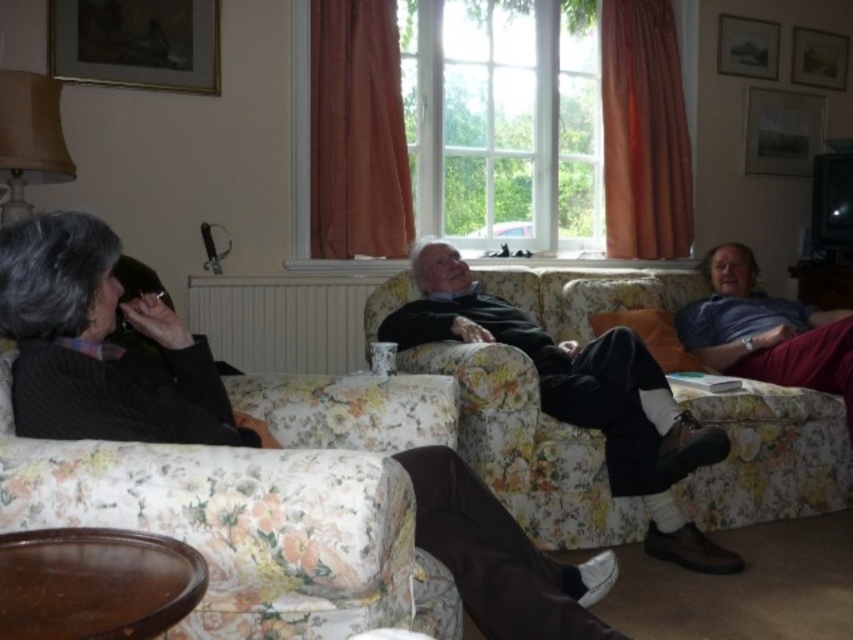
Can you confirm if black sweater at center is smaller than dark green sweater at center?

Yes.

Between point (173, 310) and point (689, 524), which one is positioned in front?

Point (173, 310) is more forward.

The height and width of the screenshot is (640, 853). In order to click on black sweater at center in this screenshot , I will do `click(100, 346)`.